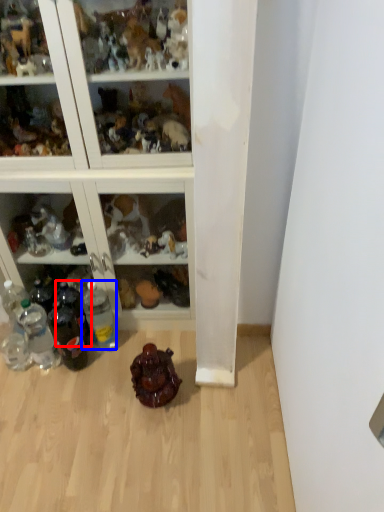
Question: Which point is closer to the camera, bottle (highlighted by a red box) or bottle (highlighted by a blue box)?

Choices:
 (A) bottle
 (B) bottle

Answer: (B)